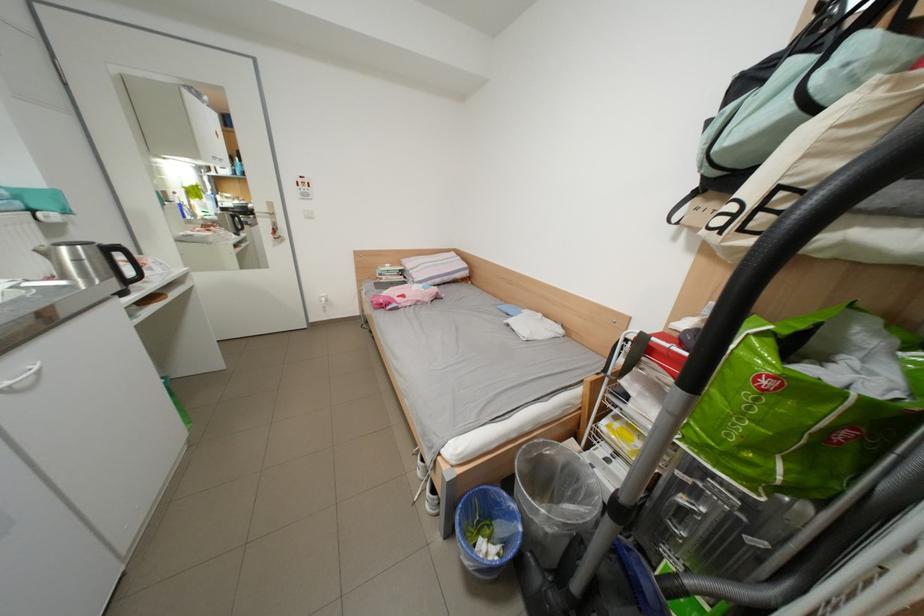
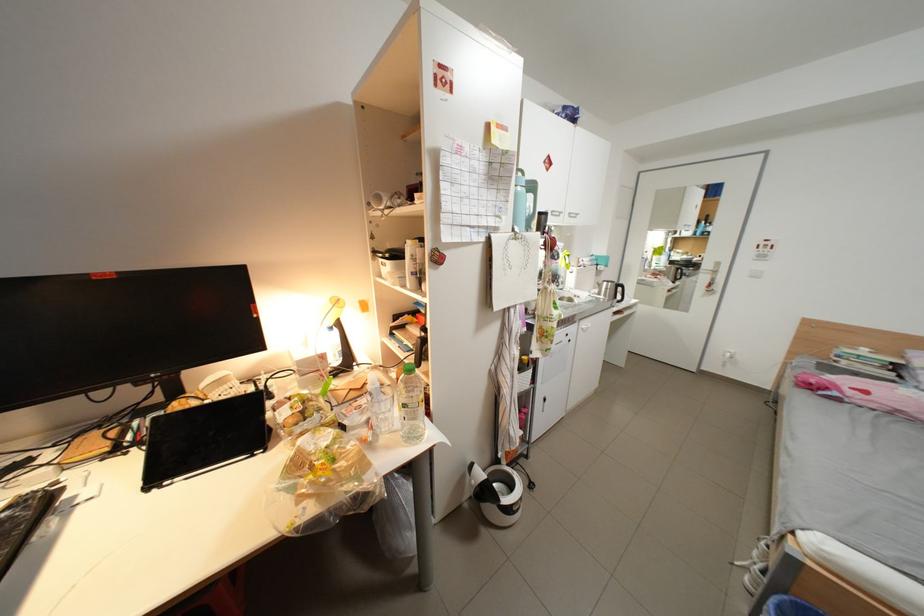
In the second image, find the point that corresponds to pixel 395 278 in the first image.

(856, 363)